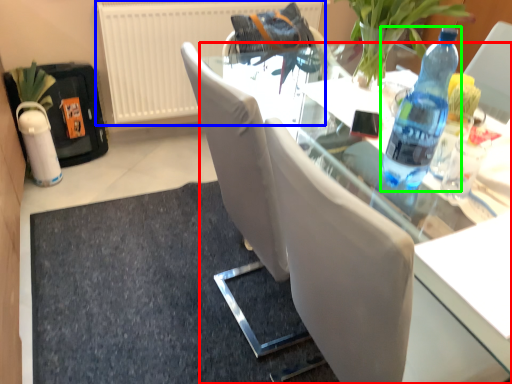
Question: Considering the real-world distances, which object is farthest from table (highlighted by a red box)? radiator (highlighted by a blue box) or bottle (highlighted by a green box)?

Choices:
 (A) radiator
 (B) bottle

Answer: (A)